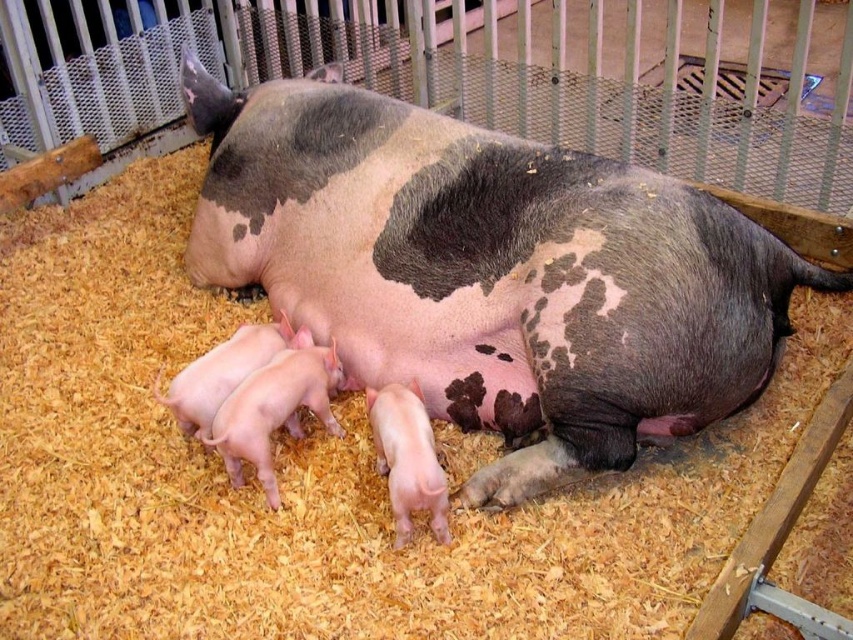
The width and height of the screenshot is (853, 640). Describe the element at coordinates (491, 269) in the screenshot. I see `speckled pink piglet at lower left` at that location.

The width and height of the screenshot is (853, 640). Find the location of `speckled pink piglet at lower left`. speckled pink piglet at lower left is located at coordinates (491, 269).

Image resolution: width=853 pixels, height=640 pixels. Find the location of `speckled pink piglet at lower left`. speckled pink piglet at lower left is located at coordinates (491, 269).

Does pink smooth piglets at lower left have a greater height compared to pink smooth piglet at lower center?

Indeed, pink smooth piglets at lower left has a greater height compared to pink smooth piglet at lower center.

Does point (329, 346) come behind point (401, 518)?

Yes, it is behind point (401, 518).

Does point (302, 381) come farther from viewer compared to point (399, 444)?

That is True.

The height and width of the screenshot is (640, 853). I want to click on pink smooth piglets at lower left, so [x=274, y=408].

Between point (223, 173) and point (419, 456), which one is positioned in front?

Point (419, 456)

Between speckled pink piglet at lower left and pink smooth piglet at lower center, which one has more height?

speckled pink piglet at lower left is taller.

The height and width of the screenshot is (640, 853). What are the coordinates of `speckled pink piglet at lower left` in the screenshot? It's located at (491, 269).

Image resolution: width=853 pixels, height=640 pixels. What are the coordinates of `speckled pink piglet at lower left` in the screenshot? It's located at (491, 269).